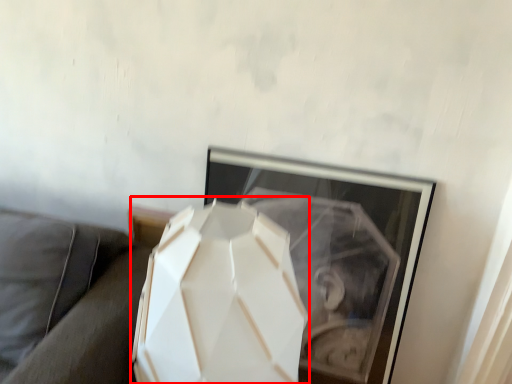
Question: Considering the relative positions of lamp (annotated by the red box) and couch in the image provided, where is lamp (annotated by the red box) located with respect to the staircase?

Choices:
 (A) right
 (B) left

Answer: (A)